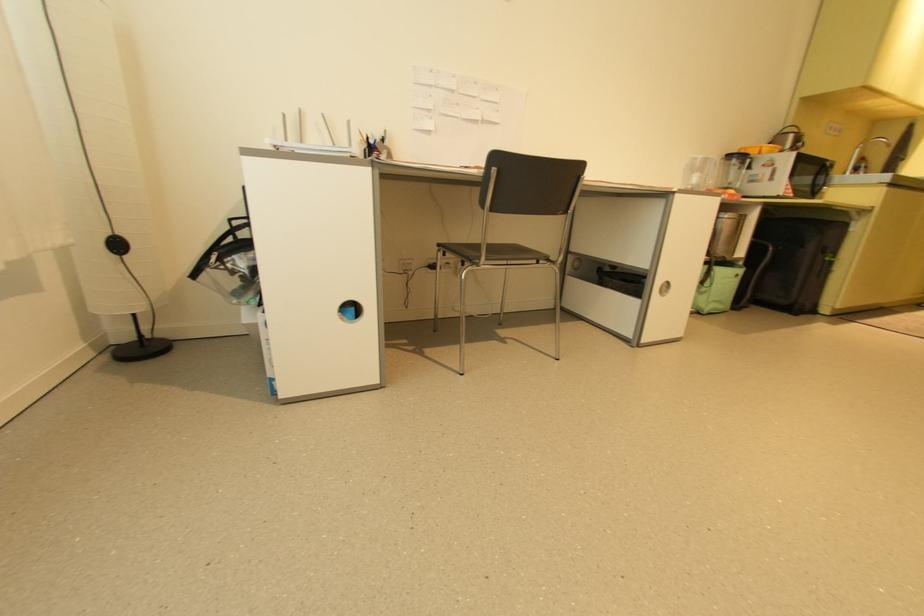
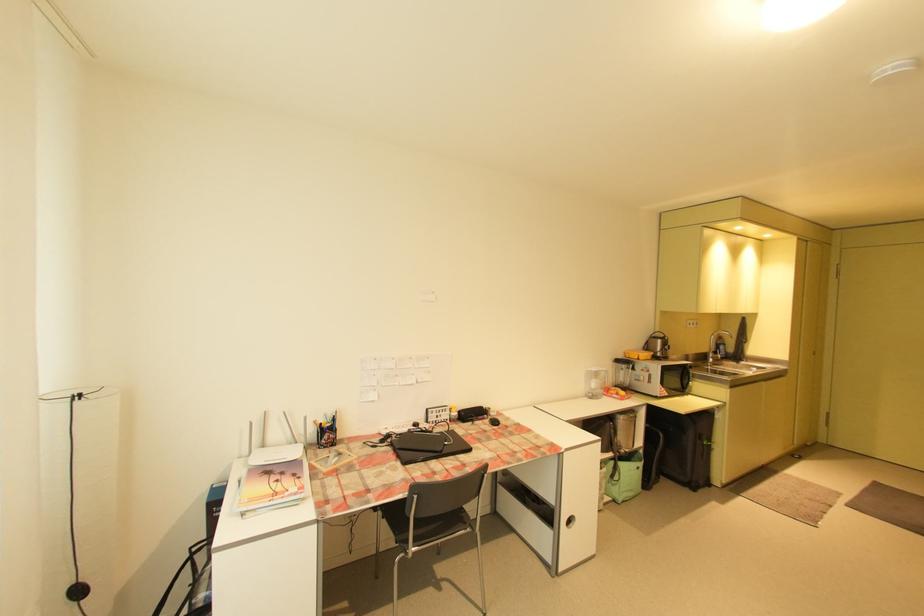
Locate, in the second image, the point that corresponds to (723,302) in the first image.

(634, 492)